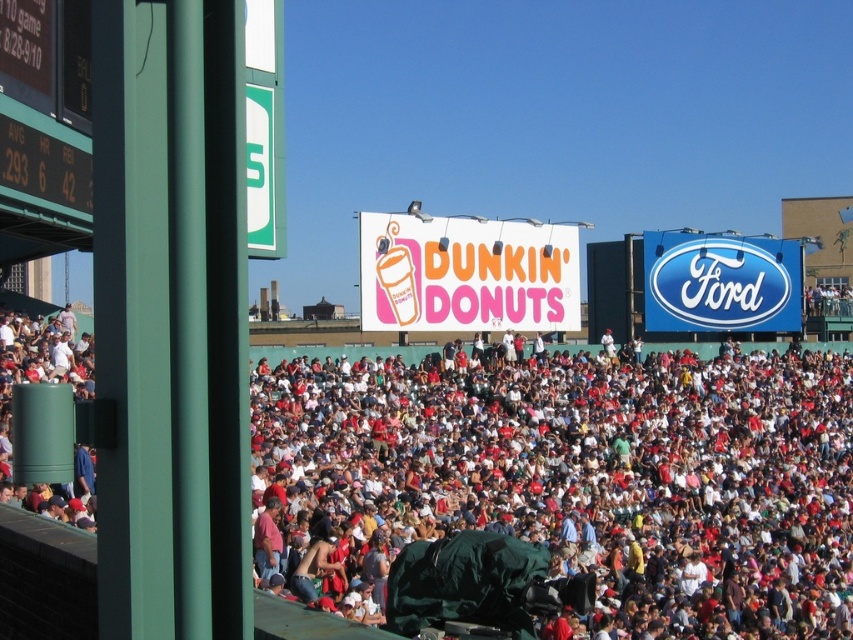
Question: Which point is closer to the camera?

Choices:
 (A) white cotton crowd at center
 (B) green digital scoreboard at left

Answer: (A)

Question: Which object appears farthest from the camera in this image?

Choices:
 (A) green digital scoreboard at left
 (B) white cotton crowd at center

Answer: (A)

Question: From the image, what is the correct spatial relationship of white cotton crowd at center in relation to green digital scoreboard at left?

Choices:
 (A) below
 (B) above

Answer: (A)

Question: Among these points, which one is nearest to the camera?

Choices:
 (A) (28, 140)
 (B) (833, 618)

Answer: (A)

Question: Can you confirm if white cotton crowd at center is positioned above green digital scoreboard at left?

Choices:
 (A) no
 (B) yes

Answer: (A)

Question: Is white cotton crowd at center below green digital scoreboard at left?

Choices:
 (A) yes
 (B) no

Answer: (A)